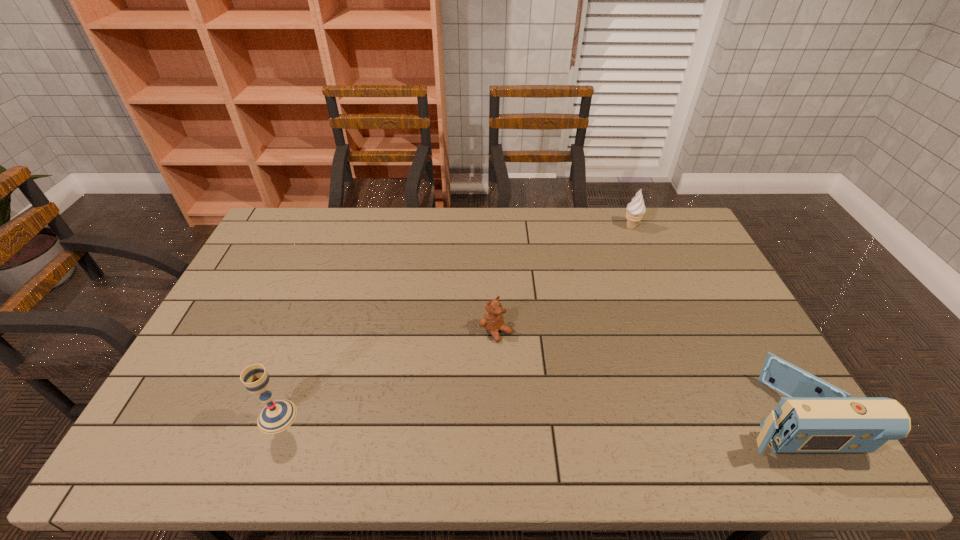
I want to click on vacant space at the left edge of the desktop, so click(243, 313).

This screenshot has width=960, height=540. Identify the location of free space at the right edge. (705, 308).

The height and width of the screenshot is (540, 960). In order to click on free space at the far right corner in this screenshot , I will do `click(676, 228)`.

Locate an element on the screen. The height and width of the screenshot is (540, 960). free space at the near right corner of the desktop is located at coordinates (748, 391).

This screenshot has width=960, height=540. I want to click on empty location between the third object from left to right and the rightmost object, so click(x=709, y=322).

Where is `free area in between the leftmost object and the second object from right to left`? The height and width of the screenshot is (540, 960). free area in between the leftmost object and the second object from right to left is located at coordinates (454, 322).

The width and height of the screenshot is (960, 540). I want to click on free space that is in between the chalice and the camcorder, so click(x=533, y=416).

Locate an element on the screen. This screenshot has height=540, width=960. free point between the icecream and the chalice is located at coordinates (454, 322).

The width and height of the screenshot is (960, 540). What are the coordinates of `free space between the third object from left to right and the chalice` in the screenshot? It's located at (454, 322).

Locate an element on the screen. empty space between the icecream and the teddy bear is located at coordinates (564, 279).